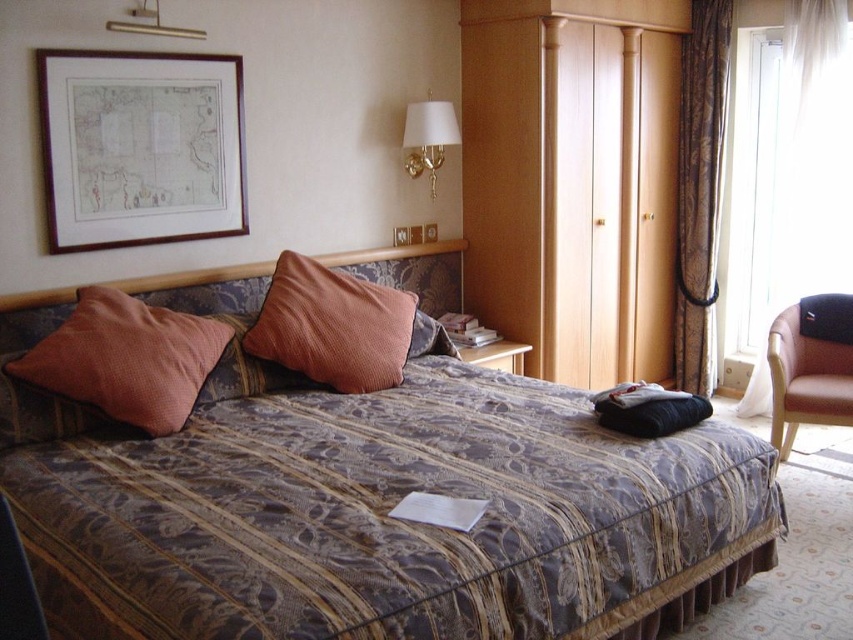
Question: Can you confirm if orange corduroy pillow at center is wider than white fabric lampshade at upper center?

Choices:
 (A) no
 (B) yes

Answer: (B)

Question: Which object is closer to the camera taking this photo?

Choices:
 (A) wooden framed map at upper left
 (B) brown leather armchair at right

Answer: (A)

Question: Is wooden framed map at upper left smaller than orange corduroy pillow at center?

Choices:
 (A) yes
 (B) no

Answer: (B)

Question: Based on their relative distances, which object is nearer to the white fabric lampshade at upper center?

Choices:
 (A) textured wood headboard at upper center
 (B) brown textured curtain at right
 (C) transparent glass window at right

Answer: (A)

Question: Which of these objects is positioned closest to the orange corduroy pillow at center?

Choices:
 (A) brown leather armchair at right
 (B) brown textured curtain at right
 (C) textured wood headboard at upper center

Answer: (C)

Question: Is wooden framed map at upper left to the right of white fabric lampshade at upper center from the viewer's perspective?

Choices:
 (A) no
 (B) yes

Answer: (A)